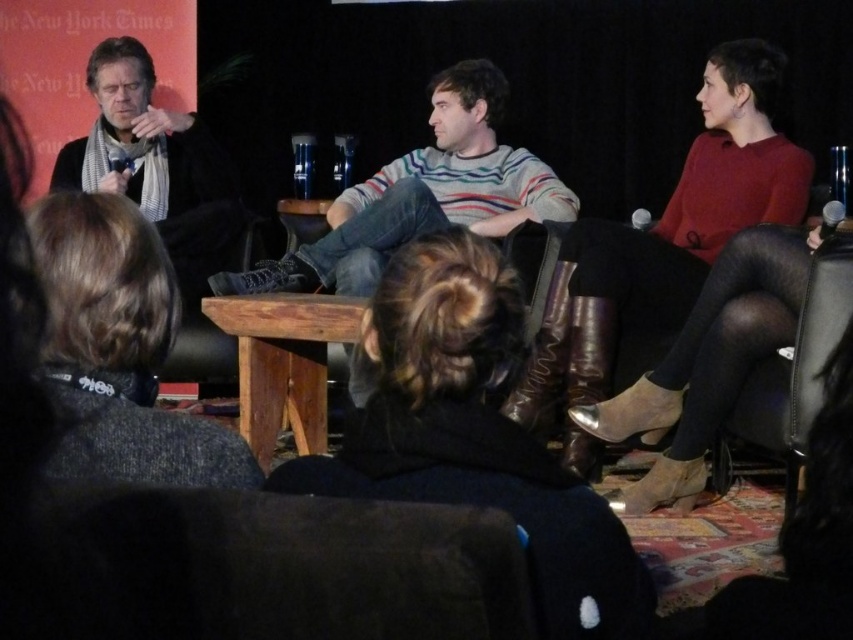
Which is behind, point (68, 186) or point (815, 410)?

The point (68, 186) is more distant.

Measure the distance between matte black scarf at left and camera.

They are 10.86 feet apart.

I want to click on matte black scarf at left, so click(x=155, y=164).

Who is positioned more to the right, striped sweater at center or matte black scarf at left?

striped sweater at center

Can you confirm if striped sweater at center is smaller than matte black scarf at left?

Incorrect, striped sweater at center is not smaller in size than matte black scarf at left.

In the scene shown: Who is more forward, [384,225] or [187,296]?

Positioned in front is point [384,225].

Locate an element on the screen. The width and height of the screenshot is (853, 640). striped sweater at center is located at coordinates (x=422, y=195).

Does matte black boots at right appear on the right side of matte black scarf at left?

Yes, matte black boots at right is to the right of matte black scarf at left.

Does point (747, 358) lie in front of point (141, 154)?

Yes, point (747, 358) is in front of point (141, 154).

Who is more forward, [746,282] or [64,161]?

Positioned in front is point [746,282].

At what (x,y) coordinates should I click in order to perform the action: click on matte black boots at right. Please return your answer as a coordinate pair (x, y). The height and width of the screenshot is (640, 853). Looking at the image, I should click on (708, 362).